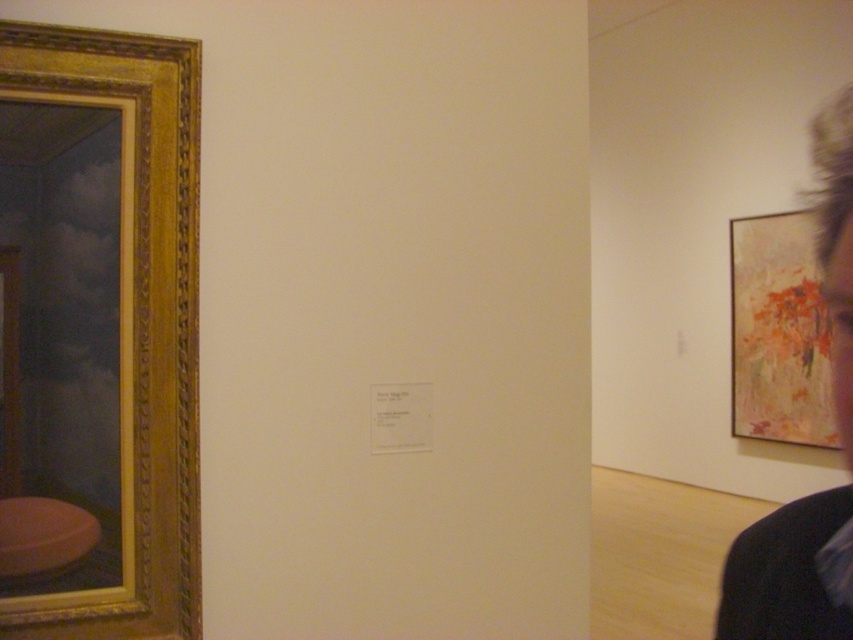
You are standing in an art gallery and see the gold ornate frame at left. If you were to walk directly towards it, which direction should you move relative to your current position?

Since the gold ornate frame at left is positioned at point 0.500 on the x axis, you should move to the left to reach it.

You are an art student trying to sketch the layout of this gallery. Given the gold ornate frame at left and the abstract painting at right, which object takes up more space in the image?

The abstract painting at right occupies more space in the image than the gold ornate frame at left according to the description.

You are an art critic attending an exhibition and notice two elements in the image. You see the dark hair at upper right and the abstract painting at right. Which of these is closer to the left side of the frame?

The dark hair at upper right is positioned on the left side of the abstract painting at right, so it is closer to the left side of the frame.